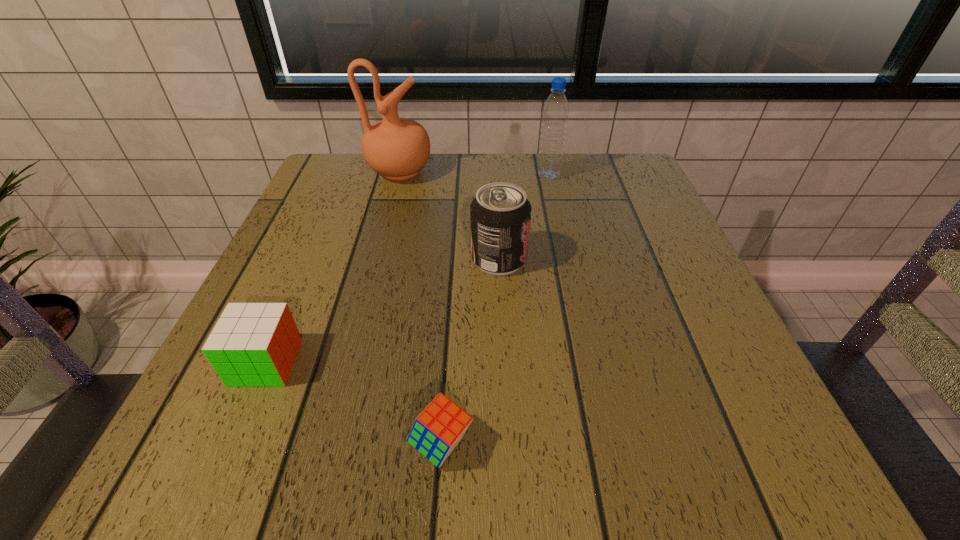
You are a GUI agent. You are given a task and a screenshot of the screen. Output one action in this format:
    pyautogui.click(x=<x>, y=<y>)
    Task: Click on the blank space at the far edge
    This screenshot has width=960, height=540.
    Given the screenshot: What is the action you would take?
    pyautogui.click(x=438, y=174)

In the image, there is a desktop. Find the location of `free space at the near edge`. free space at the near edge is located at coordinates (567, 480).

At what (x,y) coordinates should I click in order to perform the action: click on blank space at the left edge of the desktop. Please return your answer as a coordinate pair (x, y). The image size is (960, 540). Looking at the image, I should click on (317, 292).

The image size is (960, 540). I want to click on free space at the right edge of the desktop, so pos(665,389).

Where is `blank space at the far left corner of the desktop`? The height and width of the screenshot is (540, 960). blank space at the far left corner of the desktop is located at coordinates (310, 190).

At what (x,y) coordinates should I click in order to perform the action: click on vacant space at the far right corner. Please return your answer as a coordinate pair (x, y). The height and width of the screenshot is (540, 960). Looking at the image, I should click on (619, 197).

Locate an element on the screen. free point between the third shortest object and the right cube is located at coordinates coord(470,352).

Where is `vacant area that lies between the second object from left to right and the farther cube`? The image size is (960, 540). vacant area that lies between the second object from left to right and the farther cube is located at coordinates (333, 267).

The height and width of the screenshot is (540, 960). Find the location of `vacant space that's between the third nearest object and the nearest object`. vacant space that's between the third nearest object and the nearest object is located at coordinates (470, 352).

Find the location of a particular element. empty location between the third nearest object and the left cube is located at coordinates (382, 310).